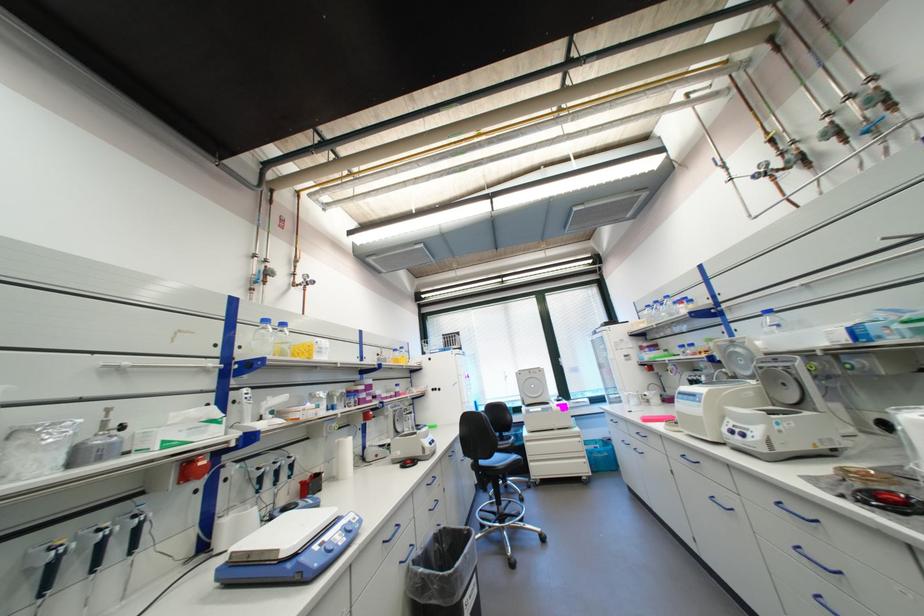
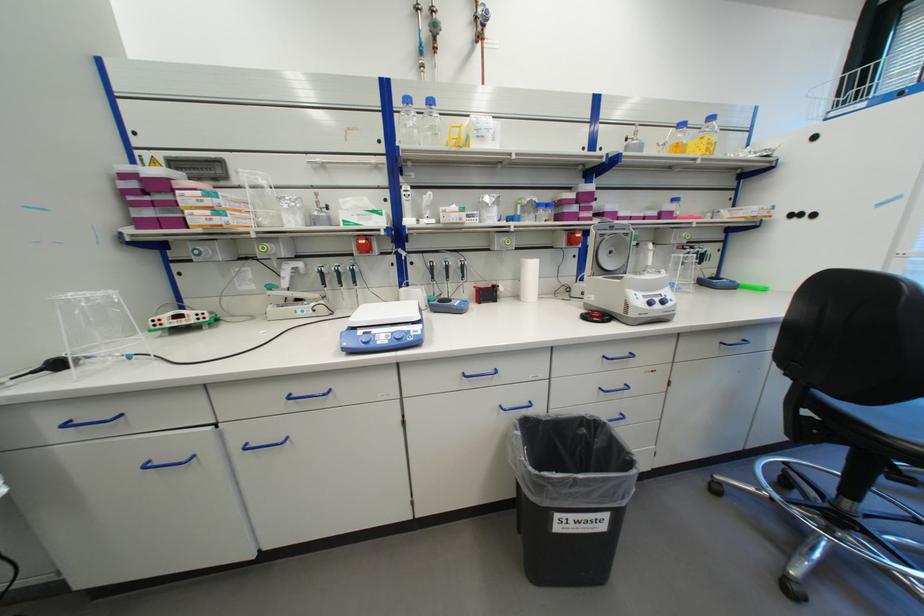
In the second image, find the point that corresponds to (x=283, y=323) in the first image.

(428, 103)